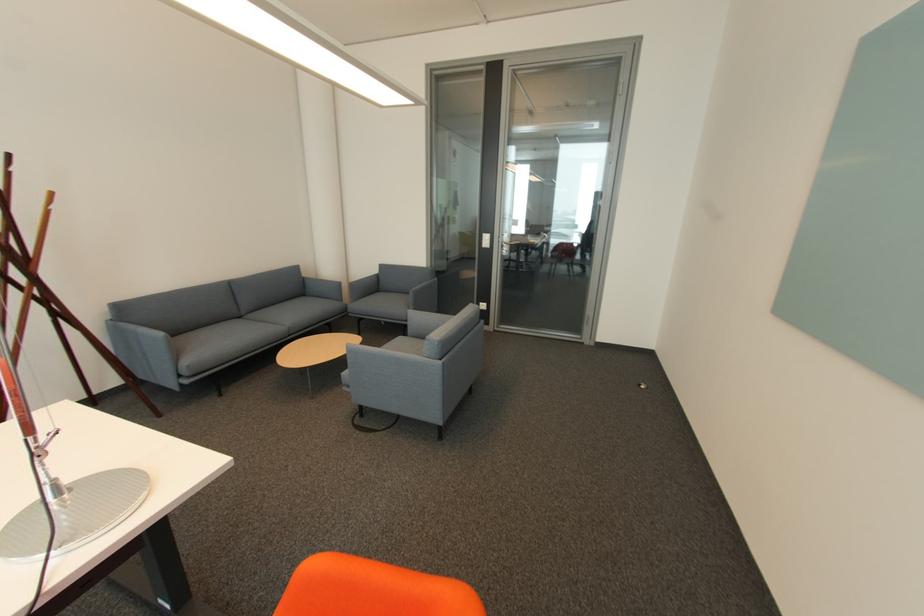
Where is `black door handle`? black door handle is located at coordinates (506, 243).